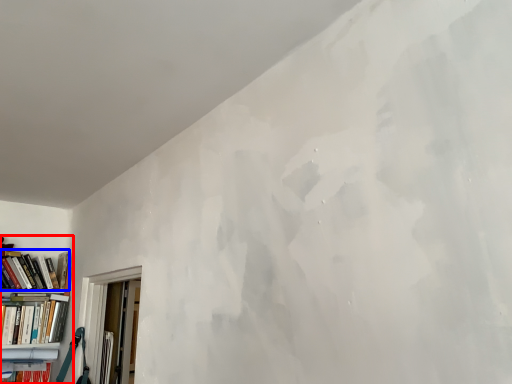
Question: Which object is further to the camera taking this photo, bookcase (highlighted by a red box) or book (highlighted by a blue box)?

Choices:
 (A) bookcase
 (B) book

Answer: (B)